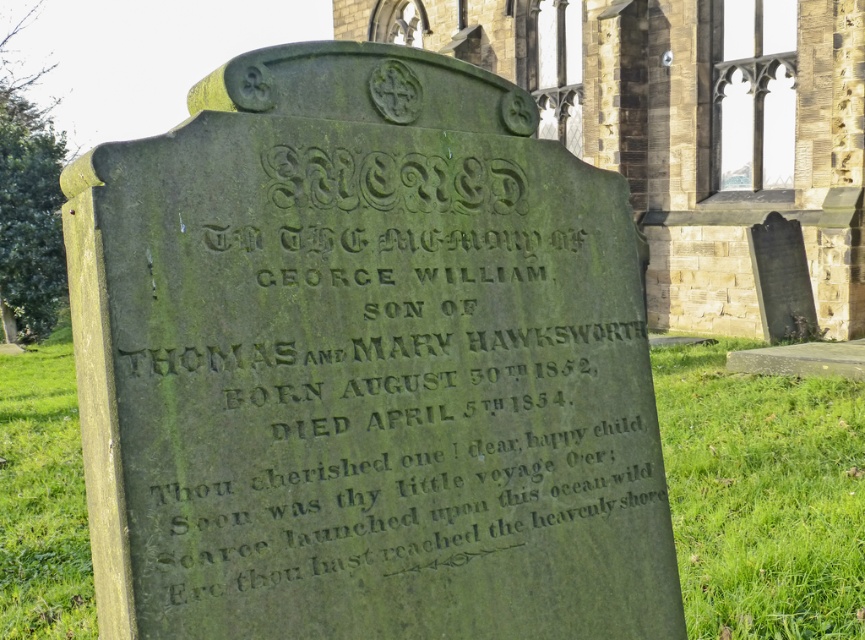
Question: Based on their relative distances, which object is farther from the green mossy stone at center?

Choices:
 (A) stone church at center
 (B) green mossy stone monument at center

Answer: (A)

Question: Does green mossy stone monument at center appear on the left side of green mossy stone at center?

Choices:
 (A) no
 (B) yes

Answer: (A)

Question: Among these objects, which one is farthest from the camera?

Choices:
 (A) green mossy stone monument at center
 (B) stone church at center

Answer: (B)

Question: Is stone church at center positioned at the back of green mossy stone at center?

Choices:
 (A) yes
 (B) no

Answer: (A)

Question: Estimate the real-world distances between objects in this image. Which object is farther from the stone church at center?

Choices:
 (A) green mossy stone at center
 (B) green mossy stone monument at center

Answer: (B)

Question: Can you confirm if green mossy stone monument at center is wider than stone church at center?

Choices:
 (A) yes
 (B) no

Answer: (B)